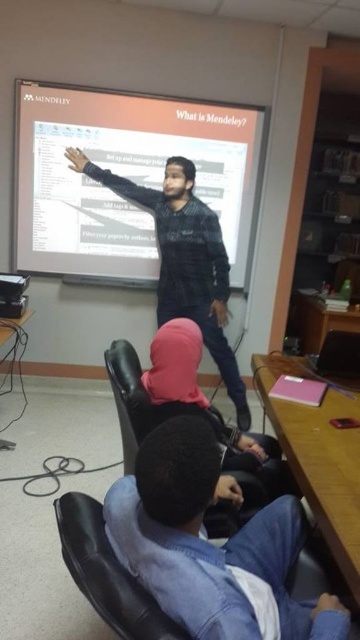
Is blue denim jacket at lower right further to the viewer compared to black textured sweater at center?

No, blue denim jacket at lower right is closer to the viewer.

Which of these two, blue denim jacket at lower right or black textured sweater at center, stands taller?

With more height is black textured sweater at center.

Who is more forward, (132,504) or (182,168)?

Point (132,504) is in front.

You are a GUI agent. You are given a task and a screenshot of the screen. Output one action in this format:
    pyautogui.click(x=<x>, y=<y>)
    Task: Click on the blue denim jacket at lower right
    
    Given the screenshot: What is the action you would take?
    pyautogui.click(x=210, y=545)

Does point (51, 147) lie in front of point (222, 522)?

No, (51, 147) is further to viewer.

Which of these two, white matte projector screen at upper center or black leather chair at lower center, stands shorter?

black leather chair at lower center is shorter.

Between point (59, 163) and point (131, 349), which one is positioned behind?

The point (59, 163) is behind.

Where is `white matte projector screen at upper center`? This screenshot has width=360, height=640. white matte projector screen at upper center is located at coordinates (127, 177).

Is white matte projector screen at upper center taller than blue denim jacket at lower right?

Correct, white matte projector screen at upper center is much taller as blue denim jacket at lower right.

What do you see at coordinates (127, 177) in the screenshot? This screenshot has height=640, width=360. I see `white matte projector screen at upper center` at bounding box center [127, 177].

This screenshot has width=360, height=640. What do you see at coordinates (127, 177) in the screenshot?
I see `white matte projector screen at upper center` at bounding box center [127, 177].

This screenshot has width=360, height=640. Identify the location of white matte projector screen at upper center. (x=127, y=177).